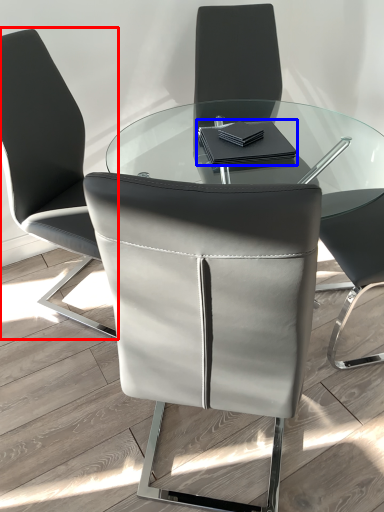
Question: Which point is further to the camera, chair (highlighted by a red box) or notebook (highlighted by a blue box)?

Choices:
 (A) chair
 (B) notebook

Answer: (B)